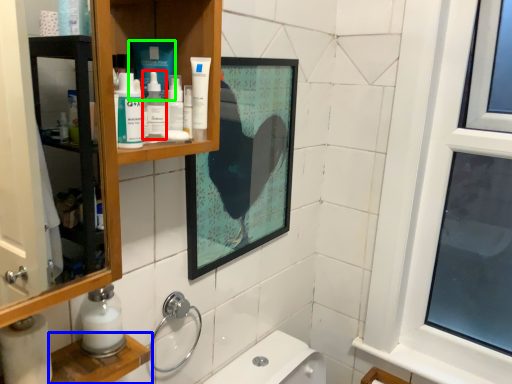
Question: Estimate the real-world distances between objects in this image. Which object is farther from mouthwash (highlighted by a red box), cabinet (highlighted by a blue box) or product (highlighted by a green box)?

Choices:
 (A) cabinet
 (B) product

Answer: (A)